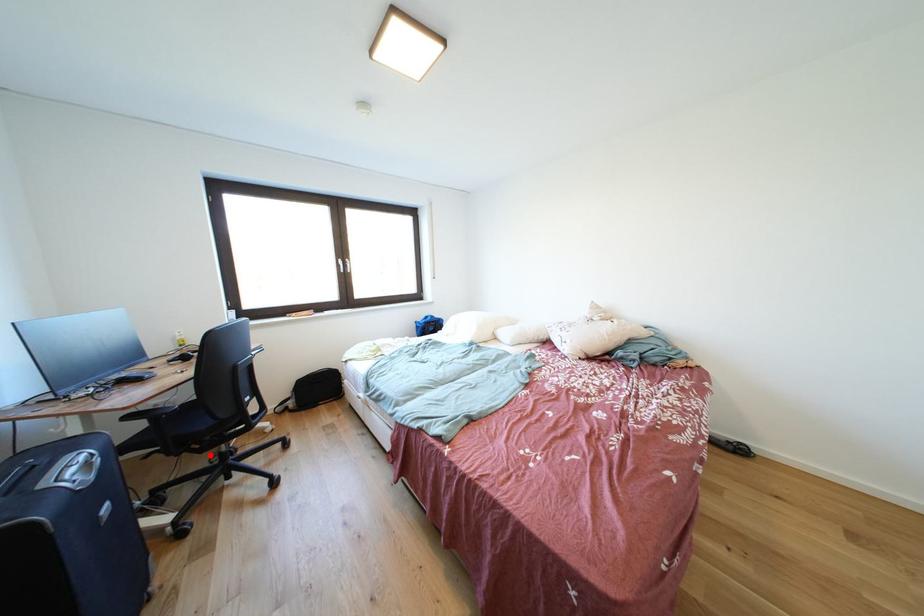
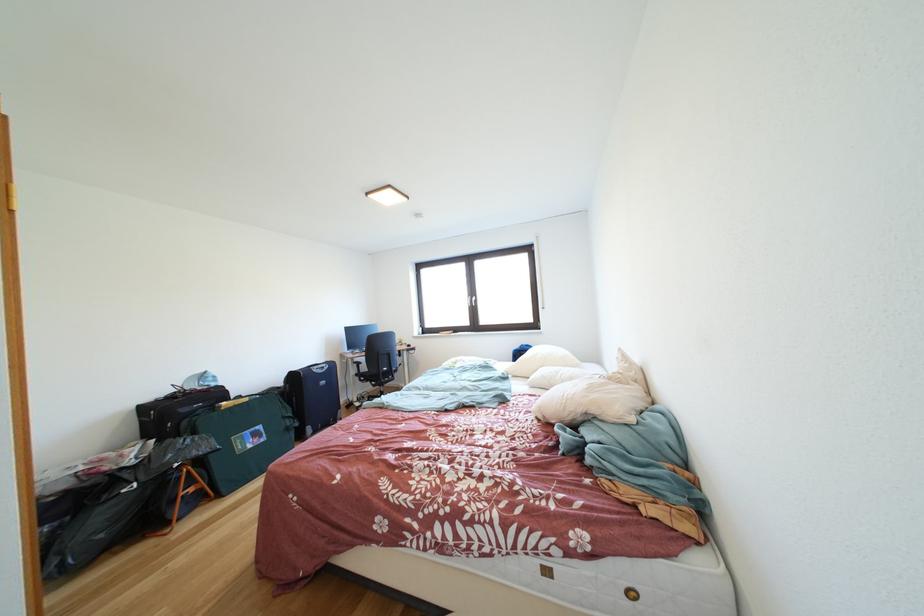
Question: I am providing you with two images of the same scene from different viewpoints. Given a red point in image1, look at the same physical point in image2. Is it:

Choices:
 (A) Closer to the viewpoint
 (B) Farther from the viewpoint

Answer: (B)